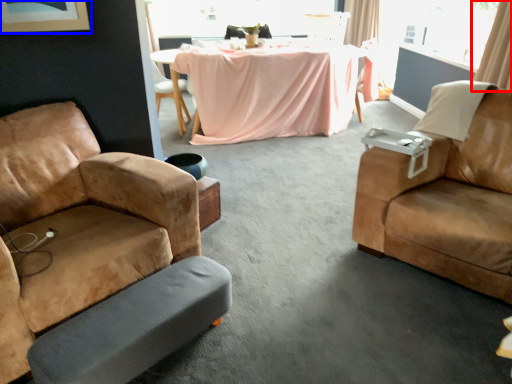
Question: Among these objects, which one is farthest to the camera, curtain (highlighted by a red box) or picture frame (highlighted by a blue box)?

Choices:
 (A) curtain
 (B) picture frame

Answer: (A)